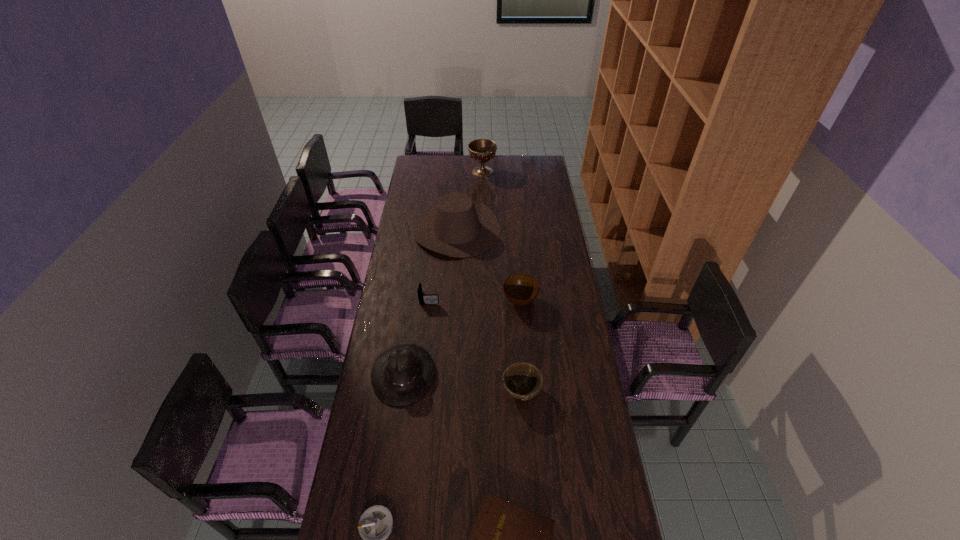
What are the coordinates of `the farthest object` in the screenshot? It's located at (482, 150).

Find the location of `cowboy hat`. cowboy hat is located at coordinates (459, 227).

Where is `hat`? hat is located at coordinates (401, 375).

Locate an element on the screen. This screenshot has height=540, width=960. the farther bowl is located at coordinates (520, 289).

Where is `the nearer bowl`? This screenshot has height=540, width=960. the nearer bowl is located at coordinates (522, 380).

Where is `the sixth tallest object`? the sixth tallest object is located at coordinates (430, 299).

You are a GUI agent. You are given a task and a screenshot of the screen. Output one action in this format:
    pyautogui.click(x=<x>, y=<y>)
    Task: Click on the vacant space located on the left of the farthest object
    This screenshot has height=540, width=960.
    Given the screenshot: What is the action you would take?
    pyautogui.click(x=457, y=172)

The image size is (960, 540). In order to click on free location located 0.250m on the back of the seventh nearest object in this screenshot , I will do `click(460, 179)`.

The width and height of the screenshot is (960, 540). Identify the location of free location located 0.380m on the front-facing side of the hat. (534, 374).

You are a GUI agent. You are given a task and a screenshot of the screen. Output one action in this format:
    pyautogui.click(x=<x>, y=<y>)
    Task: Click on the vacant space located 0.250m on the front of the farther bowl
    The image size is (960, 540).
    Given the screenshot: What is the action you would take?
    pyautogui.click(x=525, y=363)